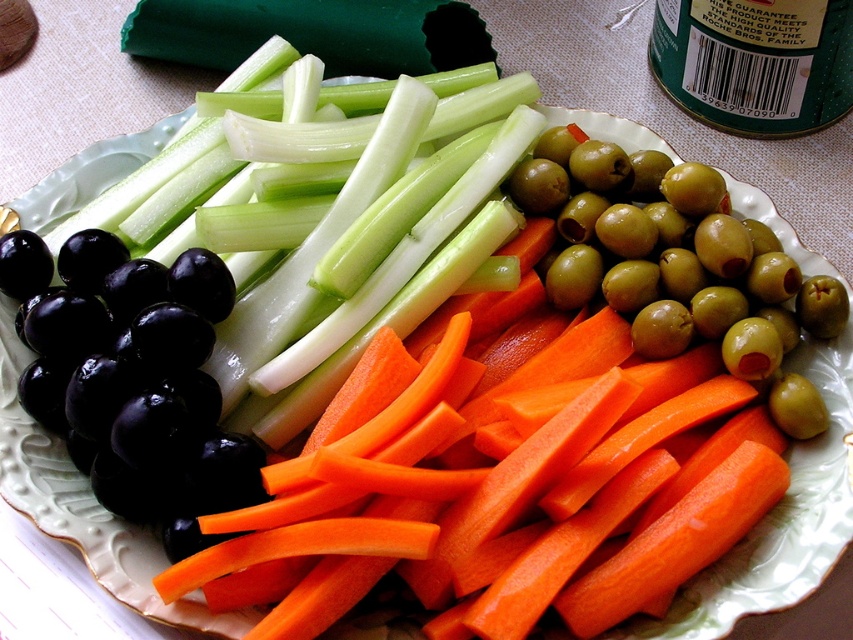
Question: Can you confirm if orange smooth carrot at center is positioned above green olive at upper right?

Choices:
 (A) yes
 (B) no

Answer: (B)

Question: Among these points, which one is nearest to the camera?

Choices:
 (A) pos(245,387)
 (B) pos(44,305)
 (C) pos(813,324)

Answer: (B)

Question: Which point is closer to the camera?

Choices:
 (A) green olive at upper right
 (B) shiny black grape at lower left
 (C) green crisp celery at left

Answer: (B)

Question: In this image, where is orange smooth carrot at center located relative to green crisp celery at left?

Choices:
 (A) below
 (B) above

Answer: (A)

Question: Is green crisp celery at left below green olive at upper right?

Choices:
 (A) yes
 (B) no

Answer: (B)

Question: Estimate the real-world distances between objects in this image. Which object is closer to the green olive at upper right?

Choices:
 (A) shiny black grape at lower left
 (B) orange smooth carrot at center

Answer: (B)